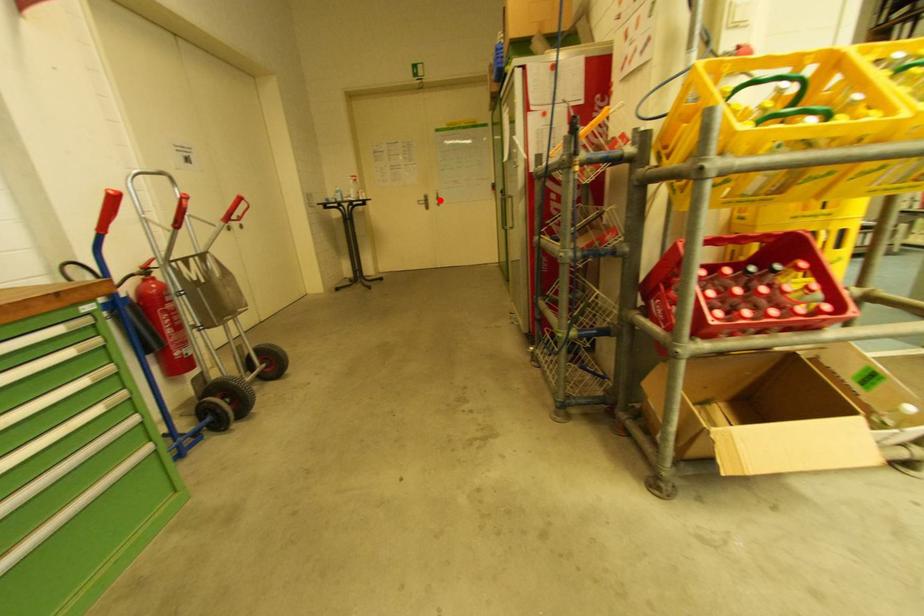
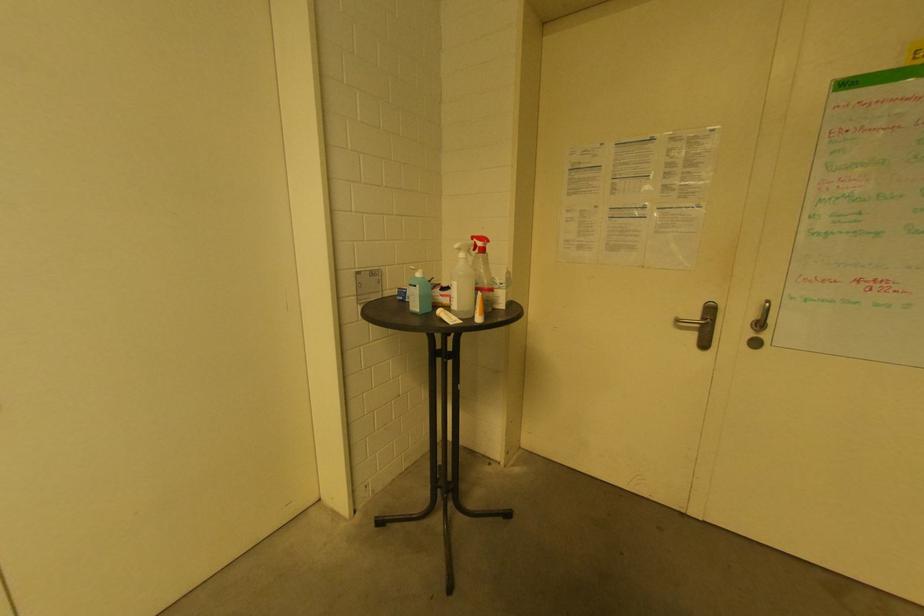
Find the pixel in the second image that matches the highlighted location in the first image.

(761, 326)